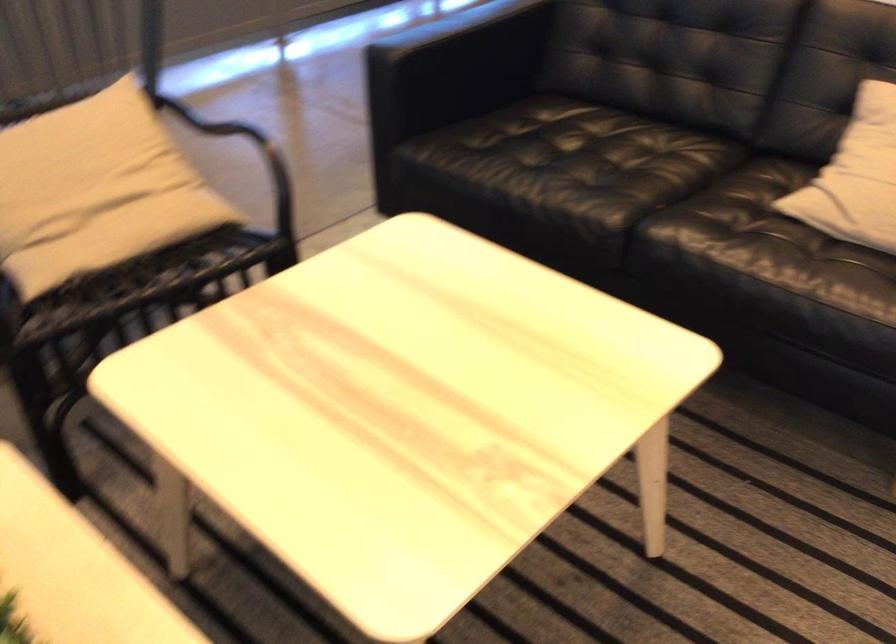
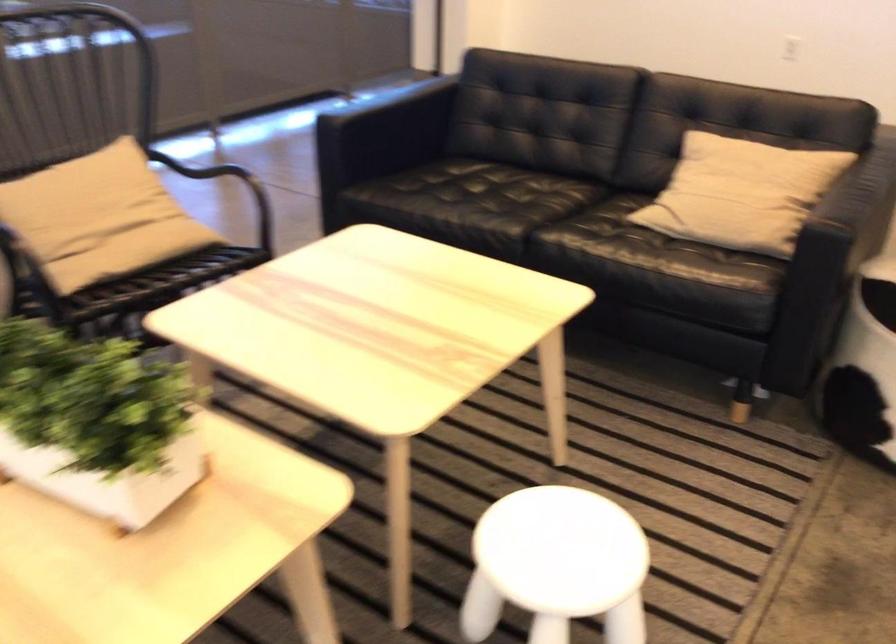
Locate, in the second image, the point that corresponds to (x=152, y=232) in the first image.

(151, 254)